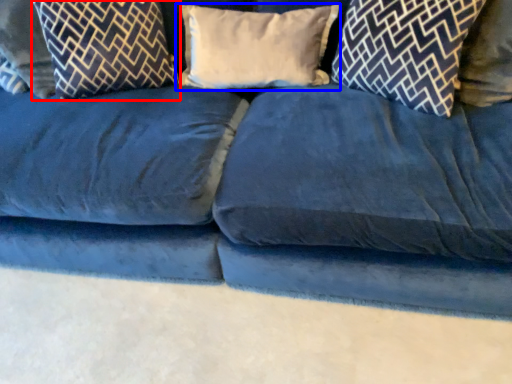
Question: Which point is further to the camera, pillow (highlighted by a red box) or pillow (highlighted by a blue box)?

Choices:
 (A) pillow
 (B) pillow

Answer: (B)